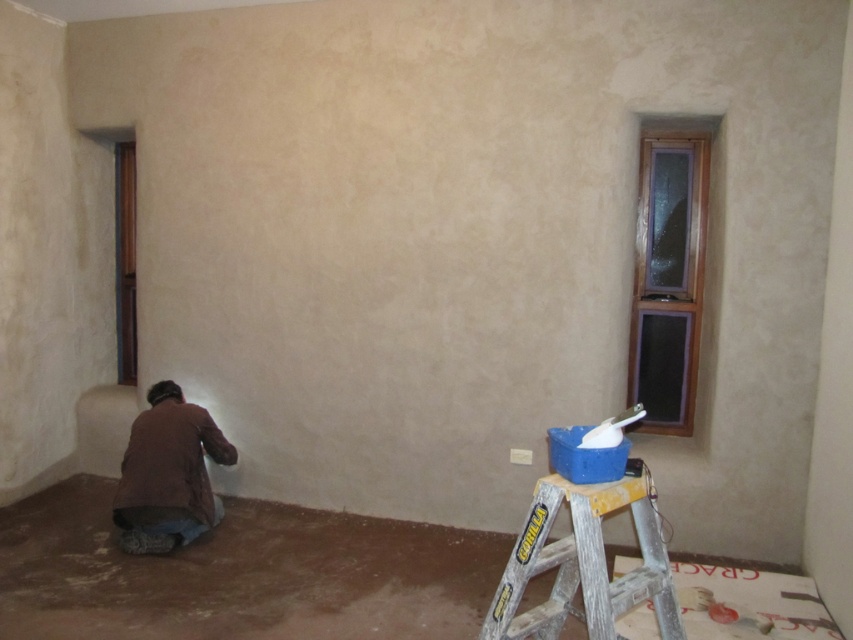
Based on the photo, does silver aluminum ladder at lower right have a greater height compared to brown fabric at lower left?

In fact, silver aluminum ladder at lower right may be shorter than brown fabric at lower left.

Which is more to the right, silver aluminum ladder at lower right or brown fabric at lower left?

silver aluminum ladder at lower right

Between point (624, 579) and point (165, 404), which one is positioned in front?

Point (624, 579)

Where is `silver aluminum ladder at lower right`? silver aluminum ladder at lower right is located at coordinates (584, 563).